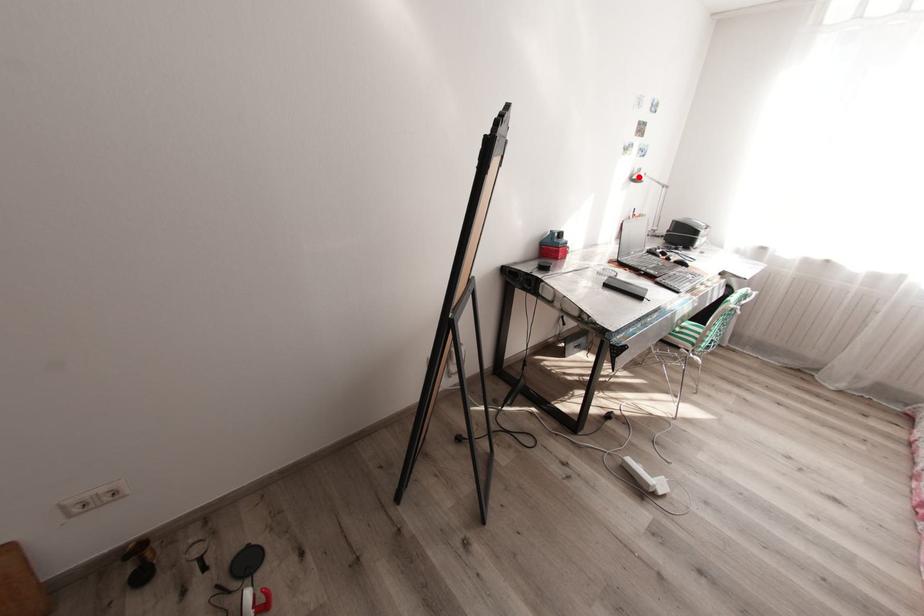
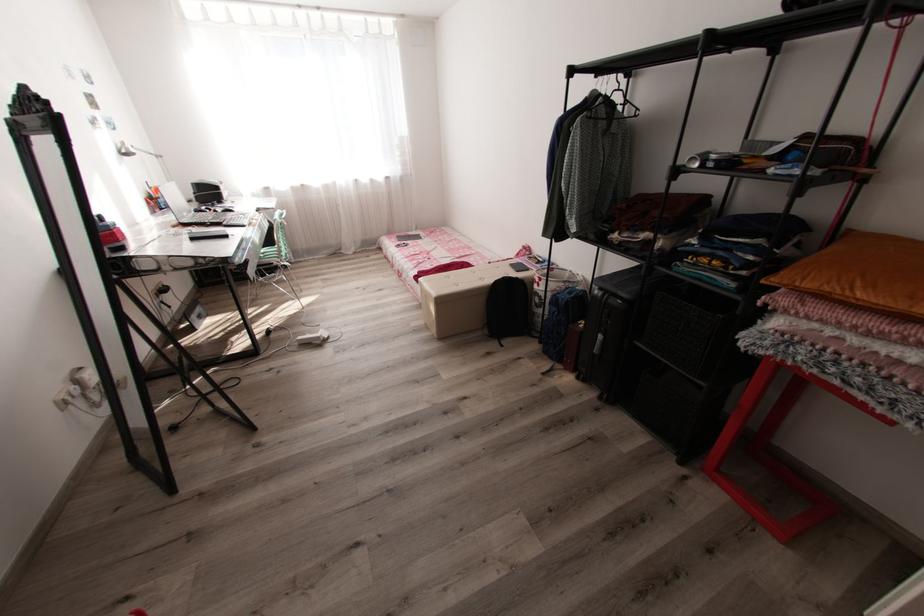
Locate, in the second image, the point that corresponds to the highlighted location in the first image.

(129, 151)